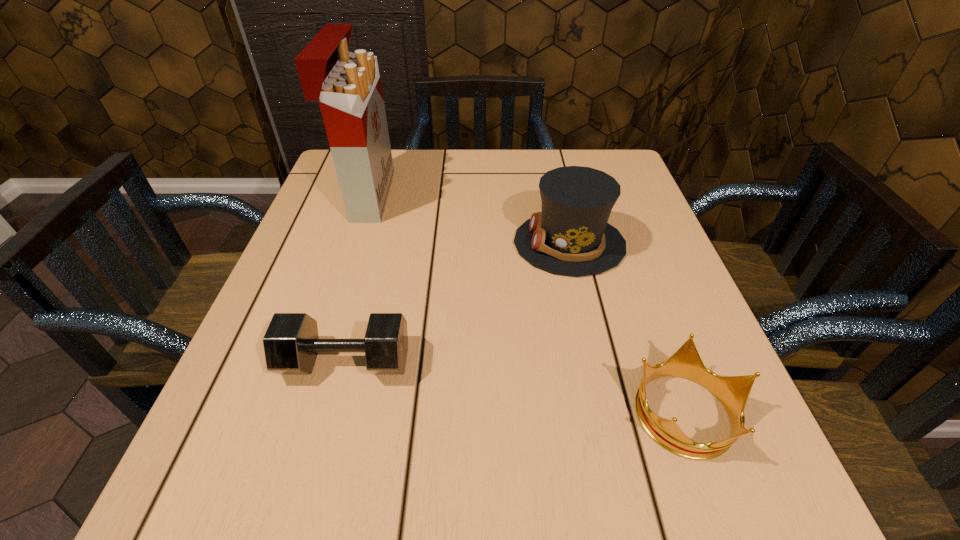
The image size is (960, 540). What are the coordinates of `vacant area in the image that satisfies the following two spatial constraints: 1. with the lid open on the cigarette case; 2. on the back side of the dumbbell` in the screenshot? It's located at (315, 361).

Locate an element on the screen. vacant area that satisfies the following two spatial constraints: 1. with the lid open on the tallest object; 2. on the right side of the crown is located at coordinates (299, 411).

The width and height of the screenshot is (960, 540). Identify the location of free space in the image that satisfies the following two spatial constraints: 1. with the lid open on the tallest object; 2. on the right side of the dumbbell. (315, 361).